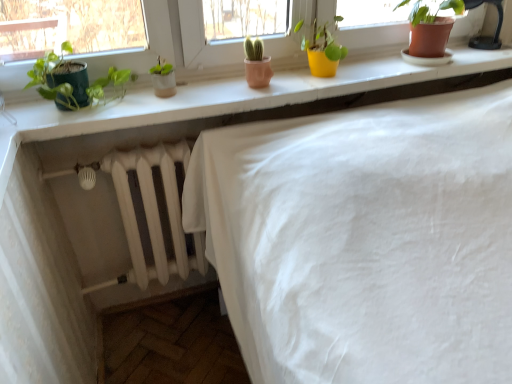
This screenshot has width=512, height=384. I want to click on empty space that is to the right of yellow matte pot at upper center, which is counted as the 2th houseplant, starting from the left, so click(361, 71).